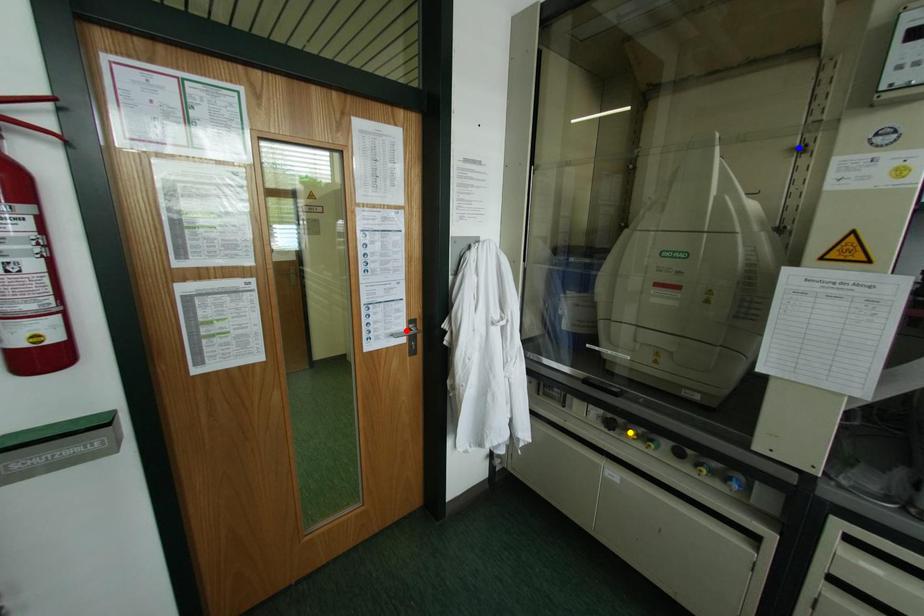
Order these from nearest to farthest:
blue point | yellow point | red point

blue point, yellow point, red point